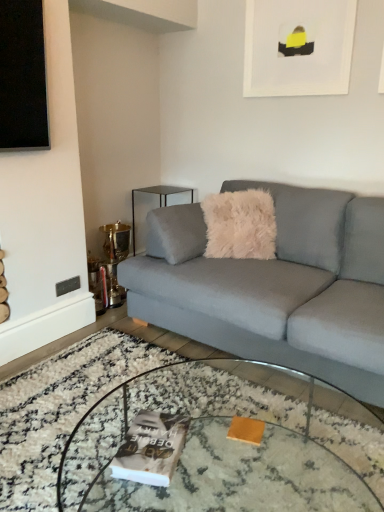
Question: Is light gray fabric couch at center further to camera compared to white matte picture frame at upper center?

Choices:
 (A) no
 (B) yes

Answer: (A)

Question: From the image's perspective, is light gray fabric couch at center over white matte picture frame at upper center?

Choices:
 (A) yes
 (B) no

Answer: (B)

Question: Can you confirm if light gray fabric couch at center is taller than white matte picture frame at upper center?

Choices:
 (A) yes
 (B) no

Answer: (A)

Question: Are light gray fabric couch at center and white matte picture frame at upper center far apart?

Choices:
 (A) no
 (B) yes

Answer: (B)

Question: From a real-world perspective, is light gray fabric couch at center below white matte picture frame at upper center?

Choices:
 (A) no
 (B) yes

Answer: (B)

Question: From a real-world perspective, is light gray fabric couch at center positioned over white matte picture frame at upper center based on gravity?

Choices:
 (A) no
 (B) yes

Answer: (A)

Question: Can you confirm if matte gray magazine at center is positioned to the right of clear glass coffee table at center?

Choices:
 (A) no
 (B) yes

Answer: (A)

Question: Is matte gray magazine at center not close to clear glass coffee table at center?

Choices:
 (A) yes
 (B) no

Answer: (B)

Question: Is matte gray magazine at center positioned behind clear glass coffee table at center?

Choices:
 (A) no
 (B) yes

Answer: (B)

Question: Considering the relative sizes of matte gray magazine at center and clear glass coffee table at center in the image provided, is matte gray magazine at center taller than clear glass coffee table at center?

Choices:
 (A) no
 (B) yes

Answer: (A)

Question: Does matte gray magazine at center have a larger size compared to clear glass coffee table at center?

Choices:
 (A) yes
 (B) no

Answer: (B)

Question: Is matte gray magazine at center completely or partially outside of clear glass coffee table at center?

Choices:
 (A) no
 (B) yes

Answer: (A)

Question: From a real-world perspective, does light gray fabric couch at center stand above clear glass coffee table at center?

Choices:
 (A) yes
 (B) no

Answer: (A)